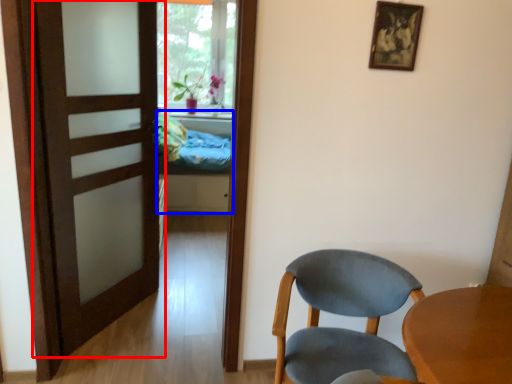
Question: Which object is closer to the camera taking this photo, door (highlighted by a red box) or bed (highlighted by a blue box)?

Choices:
 (A) door
 (B) bed

Answer: (A)